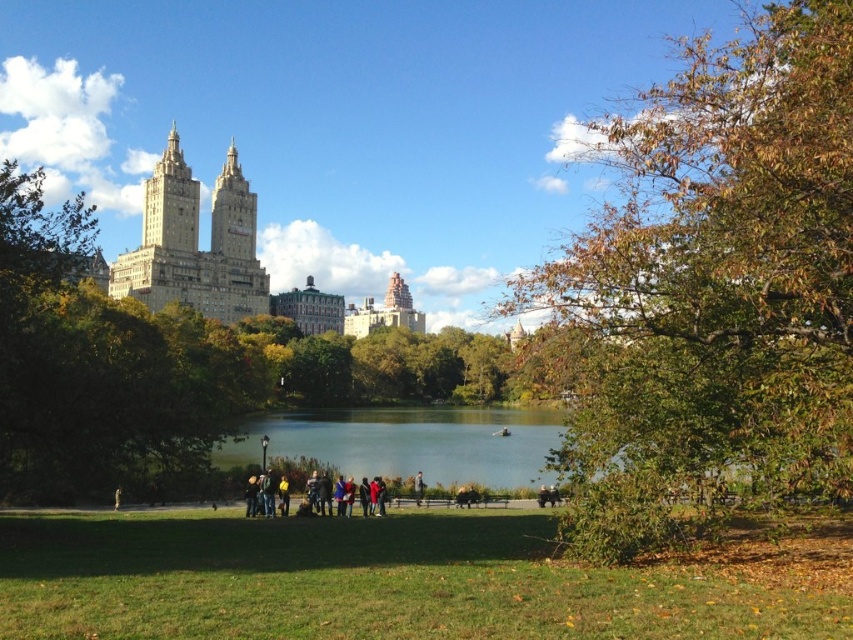
Consider the image. You are standing in the park and see a point marked at coordinates (715,285). Based on the scene description, what object is this point located on?

The point is located on the green leafy tree at center.